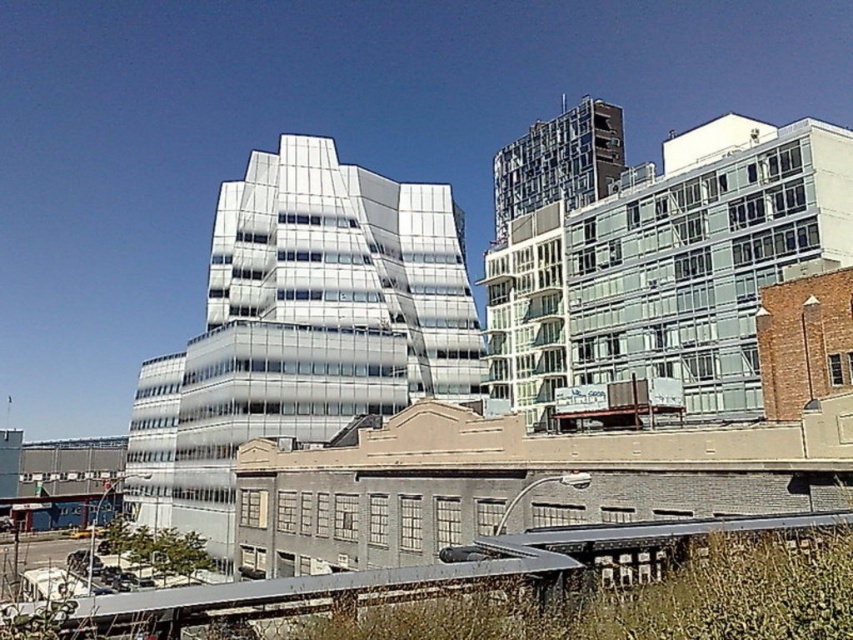
You are standing at the point marked by the coordinates point (x=302, y=326) in the image. Which building would you see directly in front of you?

The point (x=302, y=326) marks the reflective glass building at center, so you would see the reflective glass building at center directly in front of you.

You are a city planner reviewing this area. The city wants to build a new underground train station that will run parallel to the metallic gray train track at lower center. Considering the reflective glass building at center, what potential issue might arise from this construction plan?

The reflective glass building at center is located above the metallic gray train track at lower center, so constructing an underground train station parallel to the track might interfere with the building foundation or require careful planning to avoid structural damage.

You are standing at the center of the image. Which direction should you move to reach the reflective glass building at center?

The reflective glass building at center is already at the center of the image, so you don t need to move in any direction to reach it.